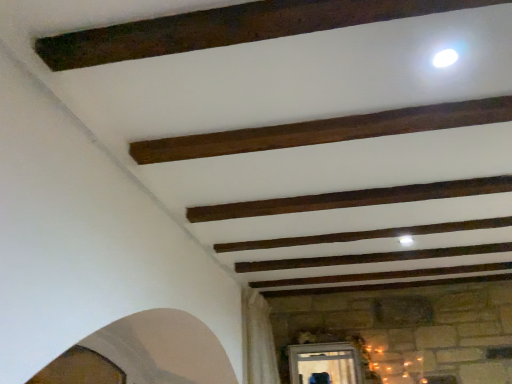
Question: Does dark brown wood plank at center, the 1th plank in the back-to-front sequence, have a lesser height compared to dark brown wood plank at upper center, acting as the 1th plank starting from the top?

Choices:
 (A) yes
 (B) no

Answer: (B)

Question: From a real-world perspective, is dark brown wood plank at center, which appears as the 1th plank when ordered from the bottom, beneath dark brown wood plank at upper center, which is the 2th plank from bottom to top?

Choices:
 (A) no
 (B) yes

Answer: (B)

Question: Does dark brown wood plank at center, which appears as the 2th plank when viewed from the top, have a lesser width compared to dark brown wood plank at upper center, positioned as the second plank in back-to-front order?

Choices:
 (A) yes
 (B) no

Answer: (A)

Question: From the image's perspective, does dark brown wood plank at center, the 1th plank in the back-to-front sequence, appear higher than dark brown wood plank at upper center, which is the 2th plank from bottom to top?

Choices:
 (A) no
 (B) yes

Answer: (A)

Question: Is dark brown wood plank at center, which appears as the 1th plank when ordered from the bottom, further to camera compared to dark brown wood plank at upper center, acting as the 1th plank starting from the top?

Choices:
 (A) no
 (B) yes

Answer: (B)

Question: Could you tell me if dark brown wood plank at center, which appears as the 1th plank when ordered from the bottom, is facing dark brown wood plank at upper center, which is the 2th plank from bottom to top?

Choices:
 (A) yes
 (B) no

Answer: (A)

Question: Is dark brown wood plank at upper center, which is the 2th plank from bottom to top, at the left side of dark brown wood plank at center, which appears as the 1th plank when ordered from the bottom?

Choices:
 (A) no
 (B) yes

Answer: (B)

Question: Does dark brown wood plank at upper center, which is counted as the 1th plank, starting from the front, have a smaller size compared to dark brown wood plank at center, the second plank viewed from the front?

Choices:
 (A) no
 (B) yes

Answer: (B)

Question: Can you confirm if dark brown wood plank at upper center, which is counted as the 1th plank, starting from the front, is wider than dark brown wood plank at center, the 1th plank in the back-to-front sequence?

Choices:
 (A) no
 (B) yes

Answer: (B)

Question: Is dark brown wood plank at upper center, positioned as the second plank in back-to-front order, with dark brown wood plank at center, the second plank viewed from the front?

Choices:
 (A) yes
 (B) no

Answer: (B)

Question: Is dark brown wood plank at upper center, which is the 2th plank from bottom to top, positioned far away from dark brown wood plank at center, the 1th plank in the back-to-front sequence?

Choices:
 (A) no
 (B) yes

Answer: (A)

Question: Considering the relative sizes of dark brown wood plank at upper center, which is counted as the 1th plank, starting from the front, and dark brown wood plank at center, which appears as the 2th plank when viewed from the top, in the image provided, is dark brown wood plank at upper center, which is counted as the 1th plank, starting from the front, bigger than dark brown wood plank at center, which appears as the 2th plank when viewed from the top,?

Choices:
 (A) no
 (B) yes

Answer: (A)

Question: Visually, is dark brown wood plank at upper center, which is counted as the 1th plank, starting from the front, positioned to the left or to the right of dark brown wood plank at center, the 1th plank in the back-to-front sequence?

Choices:
 (A) left
 (B) right

Answer: (A)